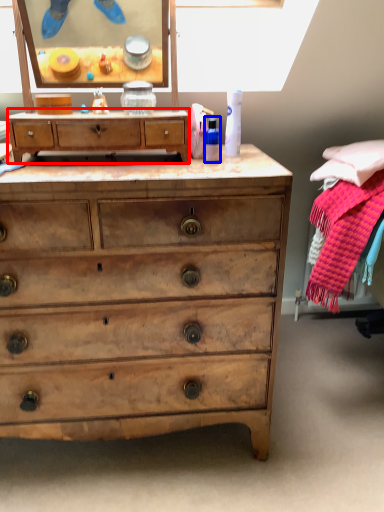
Question: Among these objects, which one is farthest to the camera, chest of drawers (highlighted by a red box) or toiletry (highlighted by a blue box)?

Choices:
 (A) chest of drawers
 (B) toiletry

Answer: (B)